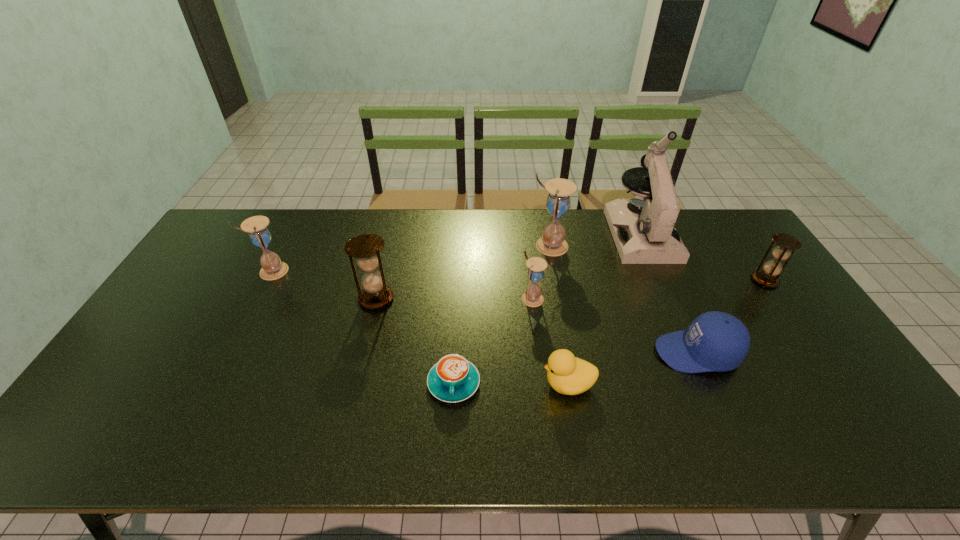
This screenshot has width=960, height=540. I want to click on free point between the second object from left to right and the rightmost hourglass, so click(x=570, y=289).

This screenshot has width=960, height=540. I want to click on vacant space in between the smallest white hourglass and the blue cap, so click(614, 326).

Where is `free area in between the shortest object and the tallest hourglass`? The height and width of the screenshot is (540, 960). free area in between the shortest object and the tallest hourglass is located at coordinates (501, 314).

The height and width of the screenshot is (540, 960). What are the coordinates of `free space between the turquoise cappuccino and the duck` in the screenshot? It's located at (511, 383).

What are the coordinates of `blank region between the tallest object and the turquoise cappuccino` in the screenshot? It's located at (547, 309).

Identify which object is the eighth closest to the rightmost hourglass. Please provide its 2D coordinates. Your answer should be formatted as a tuple, i.e. [(x, y)], where the tuple contains the x and y coordinates of a point satisfying the conditions above.

[(273, 268)]

Identify which object is the seventh nearest to the nearest white hourglass. Please provide its 2D coordinates. Your answer should be formatted as a tuple, i.e. [(x, y)], where the tuple contains the x and y coordinates of a point satisfying the conditions above.

[(768, 277)]

At what (x,y) coordinates should I click in order to perform the action: click on hourglass that is the fourth closest to the leftmost white hourglass. Please return your answer as a coordinate pair (x, y). Looking at the image, I should click on (768, 277).

Identify which hourglass is located as the second nearest to the leftmost hourglass. Please provide its 2D coordinates. Your answer should be formatted as a tuple, i.e. [(x, y)], where the tuple contains the x and y coordinates of a point satisfying the conditions above.

[(532, 297)]

Find the location of a particular element. white hourglass that is the second closest to the tallest hourglass is located at coordinates (273, 268).